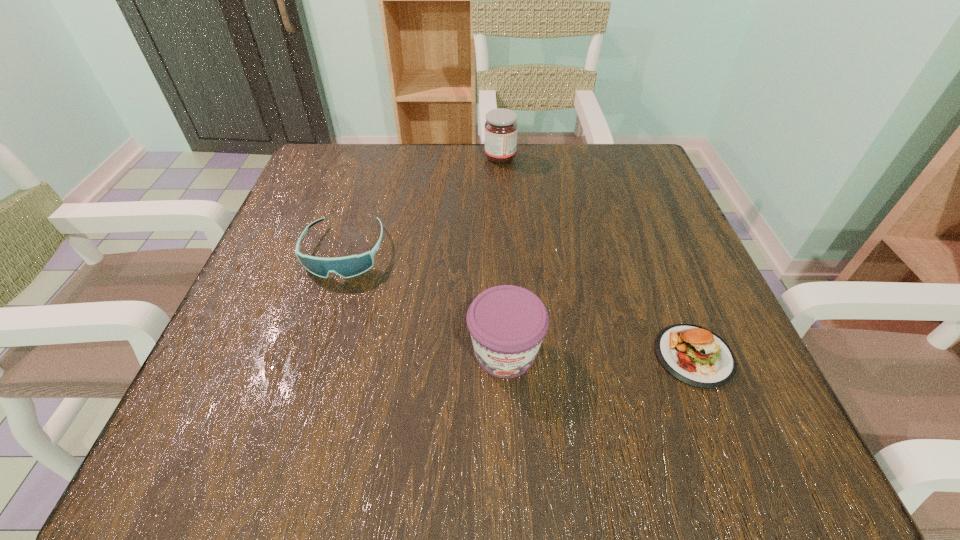
Locate an element on the screen. The image size is (960, 540). the third closest object to the shortest object is located at coordinates (501, 128).

Choose which object is the second nearest neighbor to the nearer jam. Please provide its 2D coordinates. Your answer should be formatted as a tuple, i.e. [(x, y)], where the tuple contains the x and y coordinates of a point satisfying the conditions above.

[(350, 266)]

Locate an element on the screen. Image resolution: width=960 pixels, height=540 pixels. vacant area that satisfies the following two spatial constraints: 1. on the front-facing side of the shortest object; 2. on the right side of the third tallest object is located at coordinates (312, 356).

The image size is (960, 540). I want to click on free region that satisfies the following two spatial constraints: 1. on the front-facing side of the third tallest object; 2. on the right side of the patty (food), so click(312, 356).

What are the coordinates of `vacant region that satisfies the following two spatial constraints: 1. on the front label of the nearer jam; 2. on the right side of the patty (food)` in the screenshot? It's located at (506, 356).

The image size is (960, 540). In order to click on vacant space that satisfies the following two spatial constraints: 1. on the front label of the nearer jam; 2. on the right side of the patty (food) in this screenshot , I will do `click(506, 356)`.

Find the location of a particular element. This screenshot has height=540, width=960. vacant space that satisfies the following two spatial constraints: 1. on the front-facing side of the shortest object; 2. on the left side of the goggles is located at coordinates (312, 356).